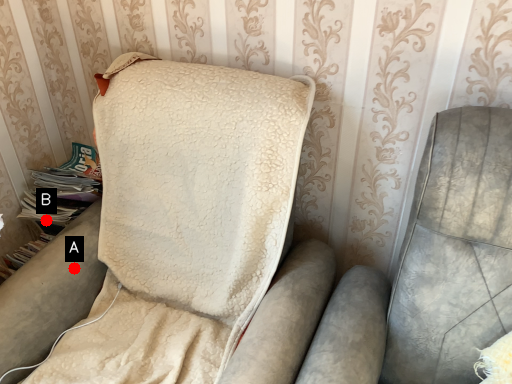
Question: Two points are circled on the image, labeled by A and B beside each circle. Which point is closer to the camera taking this photo?

Choices:
 (A) A is closer
 (B) B is closer

Answer: (A)